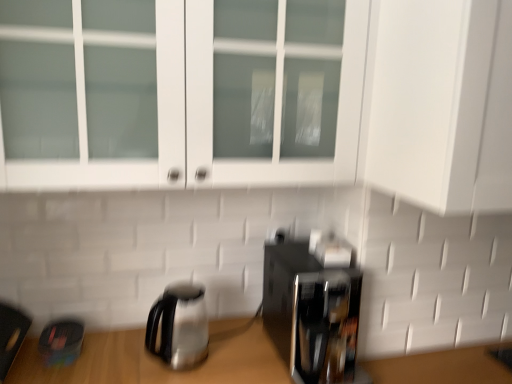
Describe the element at coordinates (268, 95) in the screenshot. I see `white glass cabinet at upper center` at that location.

What is the approximate width of black glossy coffee maker at lower right?

The width of black glossy coffee maker at lower right is 12.16 inches.

The height and width of the screenshot is (384, 512). Describe the element at coordinates (313, 307) in the screenshot. I see `black glossy coffee maker at lower right` at that location.

You are a GUI agent. You are given a task and a screenshot of the screen. Output one action in this format:
    pyautogui.click(x=<x>, y=<y>)
    Task: Click on the white glass cabinet at upper center
    The image size is (512, 384).
    Given the screenshot: What is the action you would take?
    pyautogui.click(x=268, y=95)

From a real-world perspective, is stainless steel kettle at lower left physically located above or below black glossy coffee maker at lower right?

stainless steel kettle at lower left is situated lower than black glossy coffee maker at lower right in the real world.

Is point (165, 347) closer or farther from the camera than point (349, 309)?

Point (165, 347) is closer to the camera than point (349, 309).

From the image's perspective, is stainless steel kettle at lower left under black glossy coffee maker at lower right?

Indeed, from the image's perspective, stainless steel kettle at lower left is shown beneath black glossy coffee maker at lower right.

Considering the sizes of stainless steel kettle at lower left and black glossy coffee maker at lower right in the image, is stainless steel kettle at lower left taller or shorter than black glossy coffee maker at lower right?

Clearly, stainless steel kettle at lower left is shorter compared to black glossy coffee maker at lower right.

From the image's perspective, which one is positioned higher, stainless steel kettle at lower left or white glass cabinet at upper center?

white glass cabinet at upper center appears higher in the image.

Does stainless steel kettle at lower left lie behind white glass cabinet at upper center?

Yes, stainless steel kettle at lower left is further from the camera.

Based on their positions, is stainless steel kettle at lower left located to the left or right of white glass cabinet at upper center?

From the image, it's evident that stainless steel kettle at lower left is to the left of white glass cabinet at upper center.

Which is in front, point (159, 320) or point (440, 109)?

The point (440, 109) is closer.

In the scene shown: Which is farther, (319, 233) or (170, 306)?

Positioned behind is point (319, 233).

In the scene shown: Can you tell me how much black glossy coffee maker at lower right and stainless steel kettle at lower left differ in facing direction?

The angle between the facing direction of black glossy coffee maker at lower right and the facing direction of stainless steel kettle at lower left is 0.000346 degrees.

Between black glossy coffee maker at lower right and stainless steel kettle at lower left, which one has more height?

black glossy coffee maker at lower right is taller.

Which object is more forward, black glossy coffee maker at lower right or stainless steel kettle at lower left?

black glossy coffee maker at lower right is in front.

From a real-world perspective, is white glass cabinet at upper center on top of stainless steel kettle at lower left?

Yes, from a real-world perspective, white glass cabinet at upper center is over stainless steel kettle at lower left

Is white glass cabinet at upper center oriented towards stainless steel kettle at lower left?

No.

Does white glass cabinet at upper center touch stainless steel kettle at lower left?

They are not placed beside each other.

From the image's perspective, between white glass cabinet at upper center and stainless steel kettle at lower left, which one is located above?

white glass cabinet at upper center is shown above in the image.

Considering the sizes of objects black glossy coffee maker at lower right and white glass cabinet at upper center in the image provided, who is wider, black glossy coffee maker at lower right or white glass cabinet at upper center?

white glass cabinet at upper center is wider.

Is black glossy coffee maker at lower right located outside white glass cabinet at upper center?

Yes, black glossy coffee maker at lower right is outside of white glass cabinet at upper center.

Are black glossy coffee maker at lower right and white glass cabinet at upper center located far from each other?

They are positioned close to each other.

From the image's perspective, is black glossy coffee maker at lower right located above or below white glass cabinet at upper center?

black glossy coffee maker at lower right is situated lower than white glass cabinet at upper center in the image.

Based on the photo, considering the sizes of objects white glass cabinet at upper center and black glossy coffee maker at lower right in the image provided, who is bigger, white glass cabinet at upper center or black glossy coffee maker at lower right?

With larger size is white glass cabinet at upper center.

Is white glass cabinet at upper center not within black glossy coffee maker at lower right?

Indeed, white glass cabinet at upper center is completely outside black glossy coffee maker at lower right.

Considering the relative sizes of white glass cabinet at upper center and black glossy coffee maker at lower right in the image provided, is white glass cabinet at upper center taller than black glossy coffee maker at lower right?

Yes, white glass cabinet at upper center is taller than black glossy coffee maker at lower right.

Considering the points (434, 31) and (304, 347), which point is behind, point (434, 31) or point (304, 347)?

Positioned behind is point (304, 347).

What are the coordinates of `kettle lying on the left of black glossy coffee maker at lower right` in the screenshot? It's located at (179, 325).

The image size is (512, 384). I want to click on cabinetry that is on the right side of stainless steel kettle at lower left, so click(x=268, y=95).

From the image, which object appears to be farther from stainless steel kettle at lower left, white glass cabinet at upper center or black glossy coffee maker at lower right?

white glass cabinet at upper center is further to stainless steel kettle at lower left.

Estimate the real-world distances between objects in this image. Which object is closer to white glass cabinet at upper center, black glossy coffee maker at lower right or stainless steel kettle at lower left?

The object closer to white glass cabinet at upper center is black glossy coffee maker at lower right.

Looking at the image, which one is located further to black glossy coffee maker at lower right, white glass cabinet at upper center or stainless steel kettle at lower left?

Based on the image, white glass cabinet at upper center appears to be further to black glossy coffee maker at lower right.

Estimate the real-world distances between objects in this image. Which object is further from white glass cabinet at upper center, stainless steel kettle at lower left or black glossy coffee maker at lower right?

stainless steel kettle at lower left.

Looking at the image, which one is located further to stainless steel kettle at lower left, black glossy coffee maker at lower right or white glass cabinet at upper center?

The object further to stainless steel kettle at lower left is white glass cabinet at upper center.

Considering their positions, is stainless steel kettle at lower left positioned closer to black glossy coffee maker at lower right than white glass cabinet at upper center?

stainless steel kettle at lower left is closer to black glossy coffee maker at lower right.

Find the location of `coffee maker between white glass cabinet at upper center and stainless steel kettle at lower left in the up-down direction`. coffee maker between white glass cabinet at upper center and stainless steel kettle at lower left in the up-down direction is located at coordinates (313, 307).